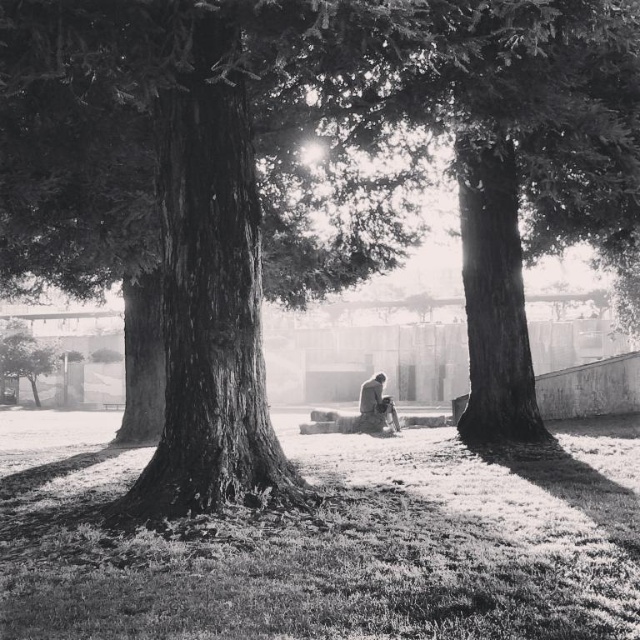
Is fuzzy grass at center positioned behind smooth gray stone bench at center?

No, it is not.

Between fuzzy grass at center and smooth gray stone bench at center, which one has more height?

smooth gray stone bench at center

Between point (358, 504) and point (380, 385), which one is positioned behind?

The point (380, 385) is behind.

The image size is (640, 640). I want to click on fuzzy grass at center, so click(328, 544).